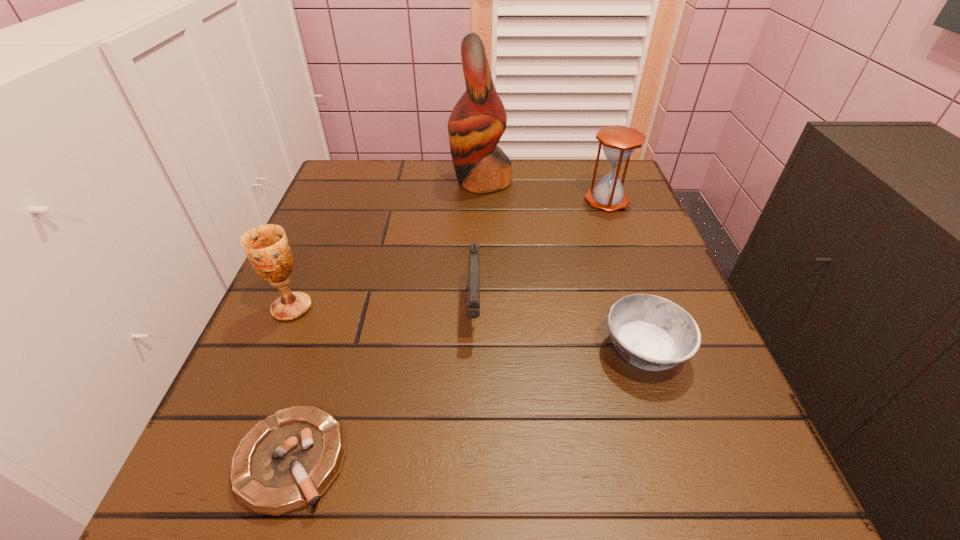
The width and height of the screenshot is (960, 540). I want to click on ashtray located in the left edge section of the desktop, so click(x=286, y=462).

The image size is (960, 540). Find the location of `hourglass at the right edge`. hourglass at the right edge is located at coordinates (619, 142).

Find the location of a particular element. The image size is (960, 540). ashtray that is at the right edge is located at coordinates (650, 332).

What are the coordinates of `object at the near left corner` in the screenshot? It's located at (286, 462).

This screenshot has height=540, width=960. What are the coordinates of `object present at the far right corner` in the screenshot? It's located at (619, 142).

This screenshot has height=540, width=960. In the image, there is a desktop. What are the coordinates of `free space at the far edge` in the screenshot? It's located at (447, 209).

At what (x,y) coordinates should I click in order to perform the action: click on blank space at the near edge. Please return your answer as a coordinate pair (x, y). Looking at the image, I should click on tap(566, 488).

Where is `vacant space at the left edge of the desktop`? This screenshot has height=540, width=960. vacant space at the left edge of the desktop is located at coordinates (341, 310).

Image resolution: width=960 pixels, height=540 pixels. What are the coordinates of `free region at the right edge of the desktop` in the screenshot? It's located at (732, 403).

You are a GUI agent. You are given a task and a screenshot of the screen. Output one action in this format:
    pyautogui.click(x=<x>, y=<y>)
    Task: Click on the blank space at the near left corner of the desktop
    The image size is (960, 540).
    Given the screenshot: What is the action you would take?
    pyautogui.click(x=198, y=478)